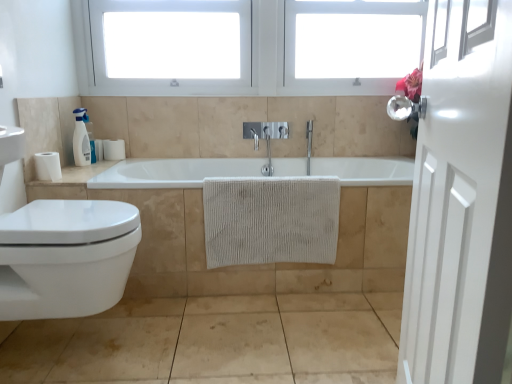
Question: Is white plastic window frame at upper center, arranged as the second window frame when viewed from the left, smaller than beige textured towel at center?

Choices:
 (A) no
 (B) yes

Answer: (A)

Question: From a real-world perspective, is white plastic window frame at upper center, arranged as the second window frame when viewed from the left, physically above beige textured towel at center?

Choices:
 (A) yes
 (B) no

Answer: (A)

Question: Is white plastic window frame at upper center, arranged as the second window frame when viewed from the left, at the left side of beige textured towel at center?

Choices:
 (A) no
 (B) yes

Answer: (A)

Question: From the image's perspective, is white plastic window frame at upper center, the first window frame positioned from the right, located beneath beige textured towel at center?

Choices:
 (A) no
 (B) yes

Answer: (A)

Question: From a real-world perspective, is white plastic window frame at upper center, the first window frame positioned from the right, under beige textured towel at center?

Choices:
 (A) yes
 (B) no

Answer: (B)

Question: Is beige textured towel at center taller or shorter than white plastic window at upper center, which is the 1th window frame from left to right?

Choices:
 (A) short
 (B) tall

Answer: (A)

Question: In terms of width, does beige textured towel at center look wider or thinner when compared to white plastic window at upper center, which is the 1th window frame from left to right?

Choices:
 (A) thin
 (B) wide

Answer: (A)

Question: From a real-world perspective, is beige textured towel at center physically located above or below white plastic window at upper center, placed as the 2th window frame when sorted from right to left?

Choices:
 (A) above
 (B) below

Answer: (B)

Question: Is beige textured towel at center bigger or smaller than white plastic window at upper center, placed as the 2th window frame when sorted from right to left?

Choices:
 (A) small
 (B) big

Answer: (A)

Question: Is point (31, 218) closer or farther from the camera than point (219, 254)?

Choices:
 (A) closer
 (B) farther

Answer: (A)

Question: Considering the positions of white glossy toilet at lower left and beige textured towel at center in the image, is white glossy toilet at lower left wider or thinner than beige textured towel at center?

Choices:
 (A) thin
 (B) wide

Answer: (B)

Question: Is white glossy toilet at lower left bigger or smaller than beige textured towel at center?

Choices:
 (A) small
 (B) big

Answer: (B)

Question: Relative to beige textured towel at center, is white glossy toilet at lower left in front or behind?

Choices:
 (A) behind
 (B) front

Answer: (B)

Question: Considering the positions of beige textured towel at center and white glossy door at right in the image, is beige textured towel at center bigger or smaller than white glossy door at right?

Choices:
 (A) big
 (B) small

Answer: (B)

Question: Is beige textured towel at center inside the boundaries of white glossy door at right, or outside?

Choices:
 (A) inside
 (B) outside

Answer: (B)